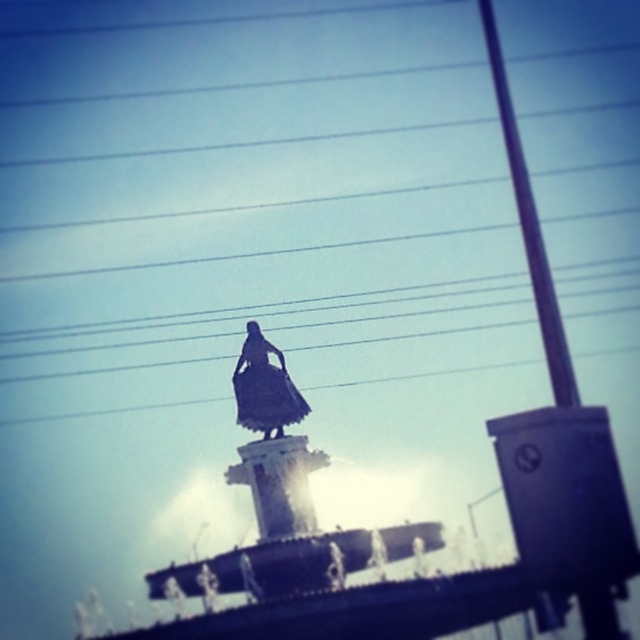
Question: Which point is farther from the camera taking this photo?

Choices:
 (A) (x=566, y=365)
 (B) (x=284, y=412)

Answer: (B)

Question: Does metallic pole at right have a greater width compared to black matte dress at center?

Choices:
 (A) yes
 (B) no

Answer: (B)

Question: Among these points, which one is farthest from the camera?

Choices:
 (A) (512, 145)
 (B) (259, 412)

Answer: (A)

Question: In this image, where is metallic pole at right located relative to black matte dress at center?

Choices:
 (A) below
 (B) above

Answer: (B)

Question: Does metallic pole at right have a smaller size compared to black matte dress at center?

Choices:
 (A) yes
 (B) no

Answer: (B)